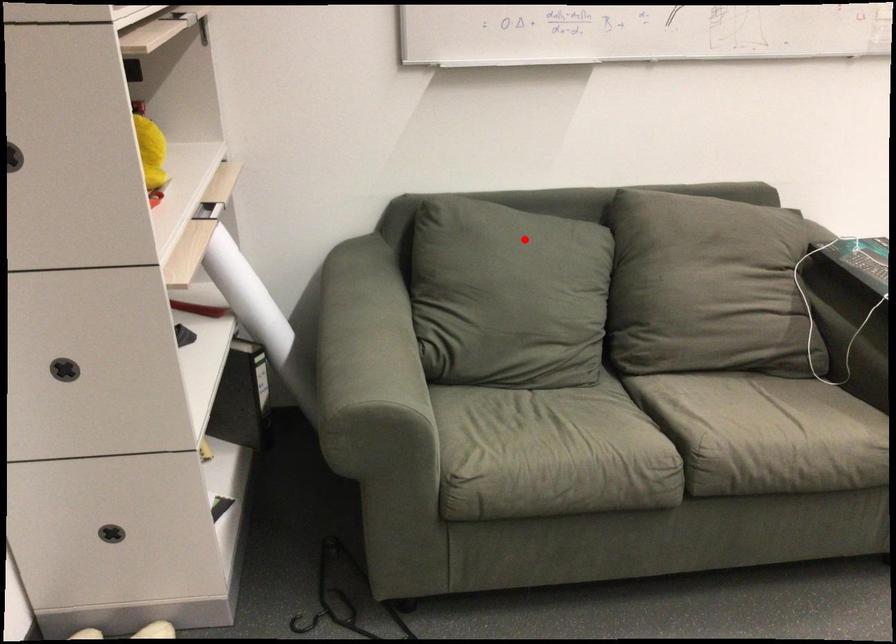
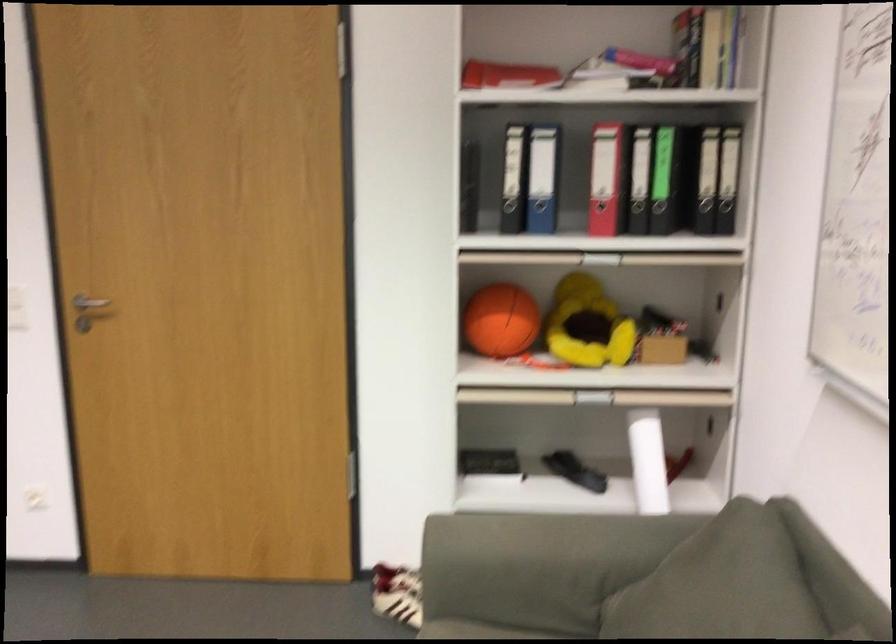
The point at the highlighted location is marked in the first image. Where is the corresponding point in the second image?

(747, 592)